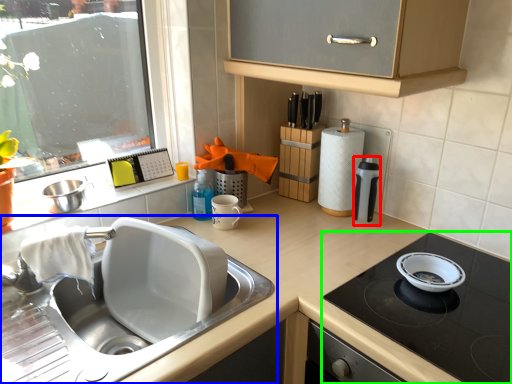
Question: Which object is the farthest from kitchen appliance (highlighted by a red box)? Choose among these: sink (highlighted by a blue box) or gas stove (highlighted by a green box).

Choices:
 (A) sink
 (B) gas stove

Answer: (A)